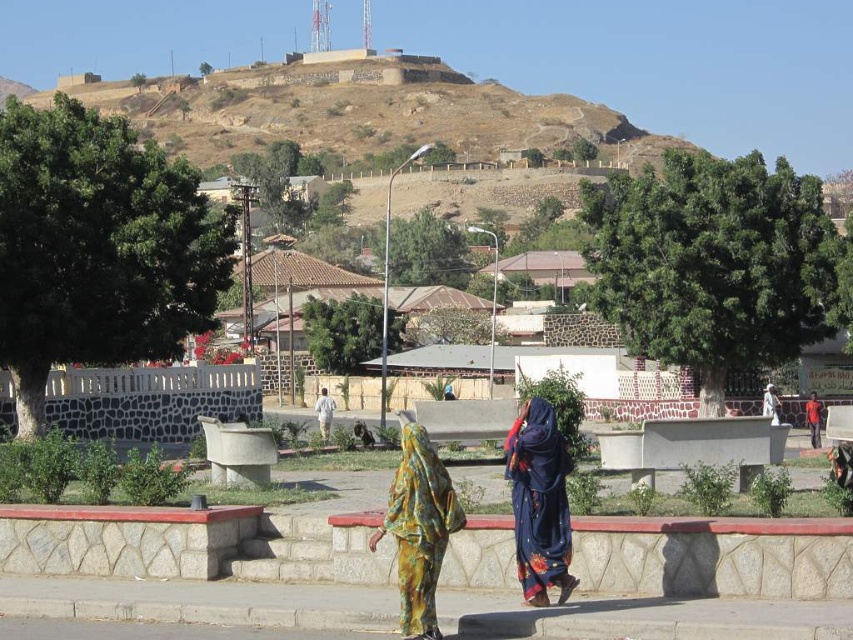
Question: Which object is the closest to the white cotton shirt at center?

Choices:
 (A) floral fabric dress at center
 (B) blue floral fabric at center

Answer: (A)

Question: Estimate the real-world distances between objects in this image. Which object is closer to the floral fabric dress at center?

Choices:
 (A) blue floral fabric at center
 (B) red cotton shirt at center
 (C) white cotton shirt at center

Answer: (A)

Question: Among these objects, which one is nearest to the camera?

Choices:
 (A) white cotton shirt at center
 (B) red cotton shirt at center

Answer: (A)

Question: Is floral fabric dress at center positioned before white cotton shirt at center?

Choices:
 (A) no
 (B) yes

Answer: (B)

Question: Where is blue floral fabric at center located in relation to white cotton shirt at center in the image?

Choices:
 (A) right
 (B) left

Answer: (A)

Question: Does floral fabric dress at center have a larger size compared to white cotton shirt at center?

Choices:
 (A) yes
 (B) no

Answer: (B)